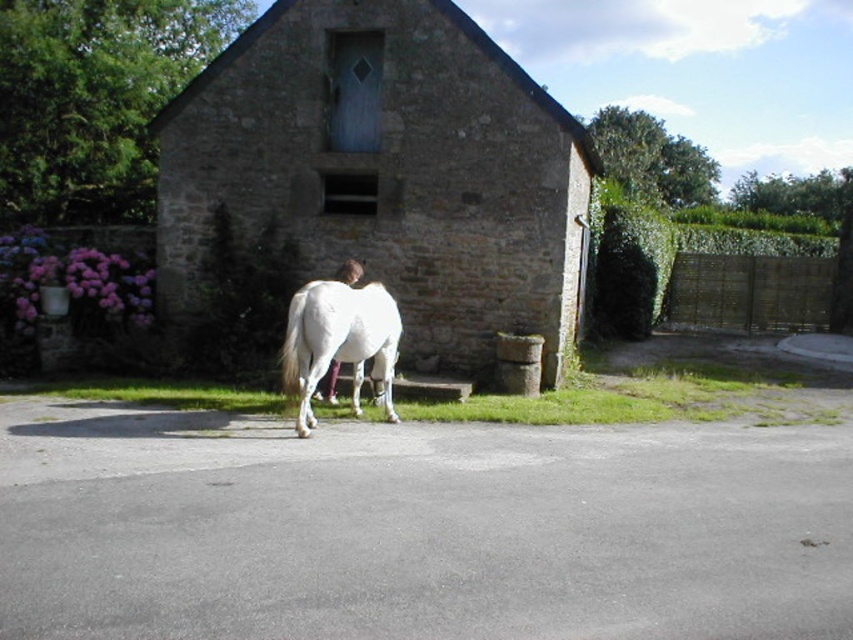
Question: Which point appears closest to the camera in this image?

Choices:
 (A) (282, 209)
 (B) (199, 548)
 (C) (349, 333)

Answer: (B)

Question: In this image, where is stone barn at center located relative to white glossy horse at center?

Choices:
 (A) above
 (B) below

Answer: (A)

Question: Which point appears farthest from the camera in this image?

Choices:
 (A) (297, 365)
 (B) (12, 570)
 (C) (329, 33)

Answer: (C)

Question: Which point is closer to the camera?

Choices:
 (A) white glossy horse at center
 (B) stone barn at center
 (C) gray asphalt driveway at center

Answer: (C)

Question: Is gray asphalt driveway at center positioned in front of stone barn at center?

Choices:
 (A) no
 (B) yes

Answer: (B)

Question: Is the position of gray asphalt driveway at center less distant than that of white glossy horse at center?

Choices:
 (A) yes
 (B) no

Answer: (A)